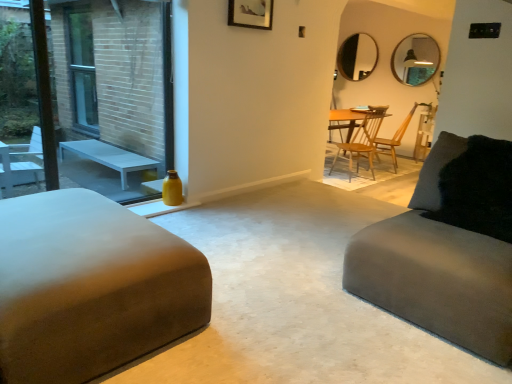
Question: Does matte black mirror at upper center, marked as the first mirror in a back-to-front arrangement, have a larger size compared to black fuzzy pillow at right?

Choices:
 (A) no
 (B) yes

Answer: (A)

Question: Is matte black mirror at upper center, arranged as the 1th mirror when viewed from the left, positioned in front of black fuzzy pillow at right?

Choices:
 (A) yes
 (B) no

Answer: (B)

Question: Considering the relative sizes of matte black mirror at upper center, marked as the first mirror in a back-to-front arrangement, and black fuzzy pillow at right in the image provided, is matte black mirror at upper center, marked as the first mirror in a back-to-front arrangement, smaller than black fuzzy pillow at right?

Choices:
 (A) no
 (B) yes

Answer: (B)

Question: Does matte black mirror at upper center, which appears as the 2th mirror when viewed from the right, have a lesser height compared to black fuzzy pillow at right?

Choices:
 (A) no
 (B) yes

Answer: (A)

Question: Is the depth of matte black mirror at upper center, marked as the first mirror in a back-to-front arrangement, greater than that of black fuzzy pillow at right?

Choices:
 (A) no
 (B) yes

Answer: (B)

Question: Can you see matte black mirror at upper center, which appears as the 2th mirror when viewed from the right, touching black fuzzy pillow at right?

Choices:
 (A) no
 (B) yes

Answer: (A)

Question: Can you confirm if wooden chair at center, which is counted as the 2th chair, starting from the left, is thinner than yellow glass bottle at left?

Choices:
 (A) no
 (B) yes

Answer: (A)

Question: Is wooden chair at center, which ranks as the first chair in right-to-left order, not near yellow glass bottle at left?

Choices:
 (A) no
 (B) yes

Answer: (B)

Question: From the image's perspective, is wooden chair at center, which is counted as the 2th chair, starting from the left, located beneath yellow glass bottle at left?

Choices:
 (A) yes
 (B) no

Answer: (B)

Question: Is the surface of wooden chair at center, which ranks as the first chair in right-to-left order, in direct contact with yellow glass bottle at left?

Choices:
 (A) no
 (B) yes

Answer: (A)

Question: Is wooden chair at center, which is counted as the 2th chair, starting from the left, positioned with its back to yellow glass bottle at left?

Choices:
 (A) yes
 (B) no

Answer: (B)

Question: Considering the relative sizes of wooden chair at center, which ranks as the first chair in right-to-left order, and yellow glass bottle at left in the image provided, is wooden chair at center, which ranks as the first chair in right-to-left order, shorter than yellow glass bottle at left?

Choices:
 (A) yes
 (B) no

Answer: (A)

Question: Can you confirm if matte black mirror at upper center, which appears as the 2th mirror when viewed from the right, is bigger than suede gray couch at right, marked as the 2th studio couch in a left-to-right arrangement?

Choices:
 (A) no
 (B) yes

Answer: (A)